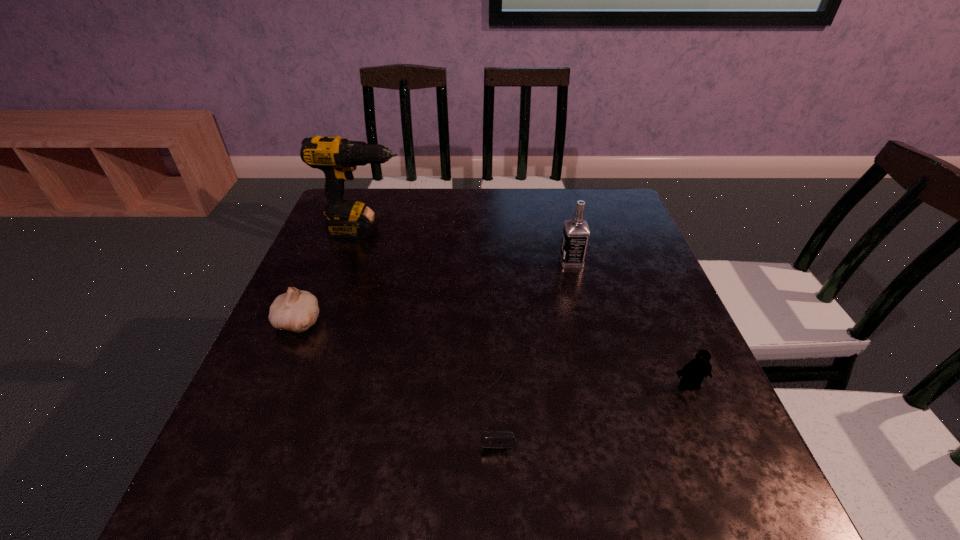
Where is `vacant area that lies between the third object from left to right and the rightmost object`? This screenshot has width=960, height=540. vacant area that lies between the third object from left to right and the rightmost object is located at coordinates (590, 396).

The height and width of the screenshot is (540, 960). Find the location of `empty space that is in between the Lego and the shortest object`. empty space that is in between the Lego and the shortest object is located at coordinates (590, 396).

At what (x,y) coordinates should I click in order to perform the action: click on vacant area between the second tallest object and the third nearest object. Please return your answer as a coordinate pair (x, y). Looking at the image, I should click on (435, 291).

Where is `free point between the webcam and the Lego`? The image size is (960, 540). free point between the webcam and the Lego is located at coordinates (590, 396).

Locate an element on the screen. The height and width of the screenshot is (540, 960). empty space between the Lego and the farthest object is located at coordinates (527, 308).

Select which object is the third closest to the garlic. Please provide its 2D coordinates. Your answer should be formatted as a tuple, i.e. [(x, y)], where the tuple contains the x and y coordinates of a point satisfying the conditions above.

[(576, 232)]

Locate an element on the screen. The image size is (960, 540). the third closest object to the farthest object is located at coordinates (498, 439).